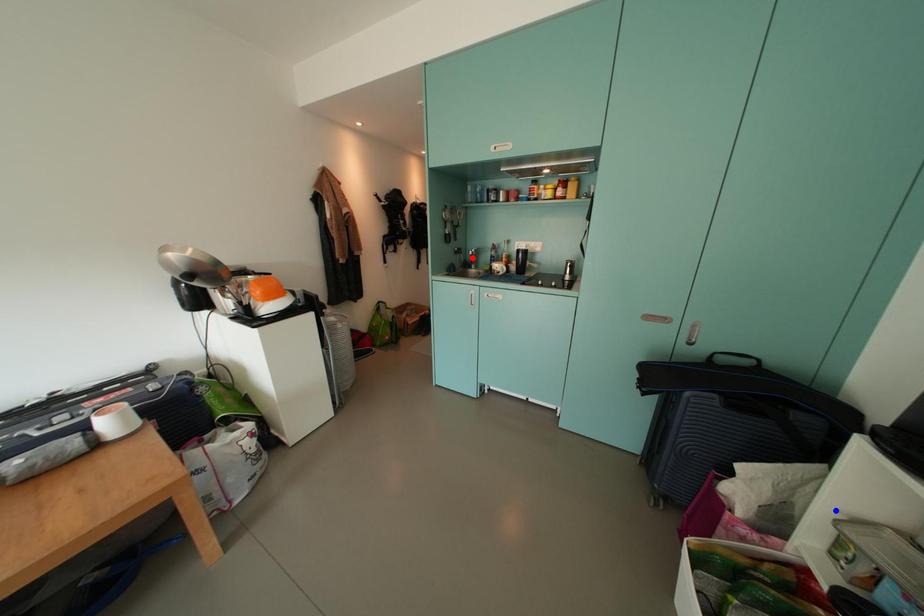
Question: Two points are marked on the image. Which point is closer to the camera?

Choices:
 (A) Blue point is closer.
 (B) Red point is closer.

Answer: (A)